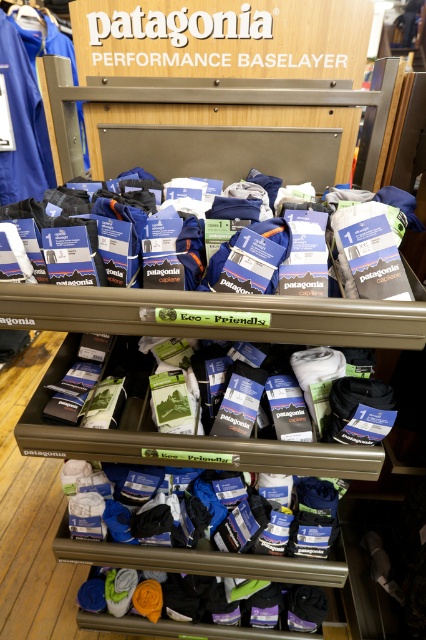
You are a customer in the store looking at the Patagonia Performance Baselayer display. You want to find the white cotton socks at center. Where exactly are they located on the display?

The white cotton socks at center are located at the coordinates point (x=180, y=440) on the display.

You are a store employee who needs to retrieve a camera that fell behind the Patagonia Performance Baselayer display. The camera is 1.01 meters away from the white cotton socks at center. Can you reach it without moving the socks?

The camera is 1.01 meters away from the white cotton socks at center. Since the socks are part of the display, moving them could disrupt the arrangement. To retrieve the camera without disturbing the socks, you can carefully reach around or behind the display while maintaining the socks in their current position.

Looking at this image, you are standing in front of the Patagonia Performance Baselayer display and need to locate the white cotton socks at center. According to the coordinates provided, where exactly are they positioned?

The white cotton socks at center are located at point coordinates of 0.688 on the x axis and 0.423 on the y axis.